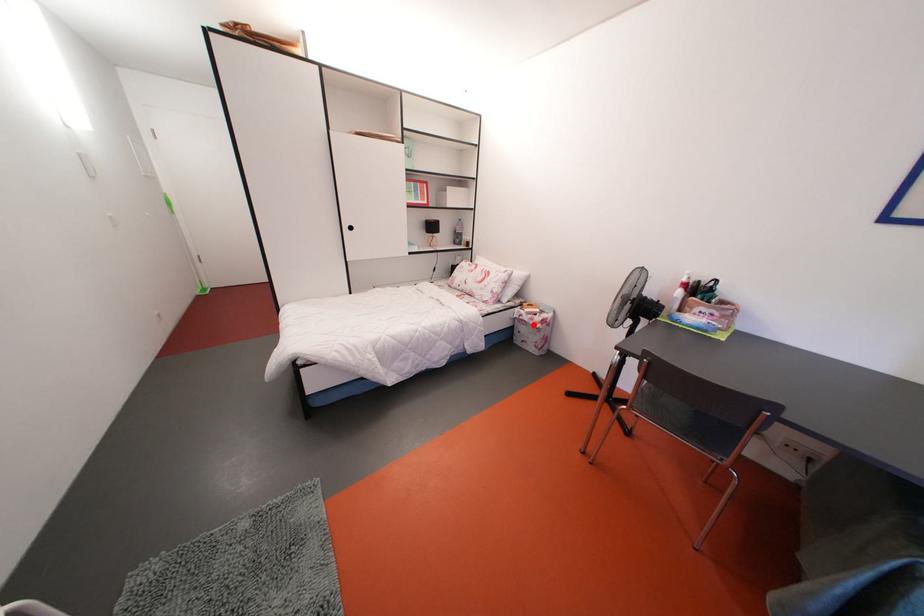
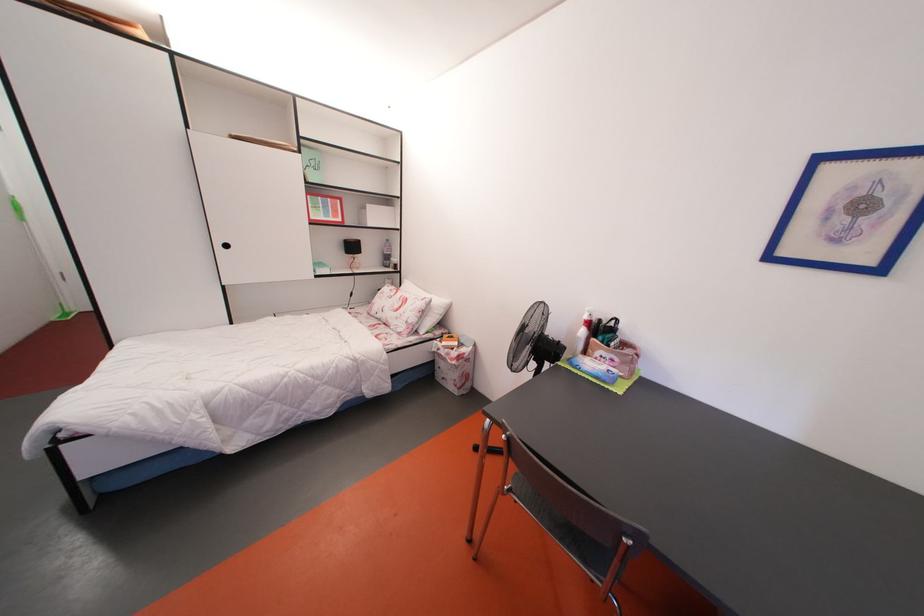
Question: A red point is marked in image1. In image2, is the corresponding 3D point closer to the camera or farther? Reply with the corresponding letter.

Choices:
 (A) The corresponding 3D point is closer.
 (B) The corresponding 3D point is farther.

Answer: (B)